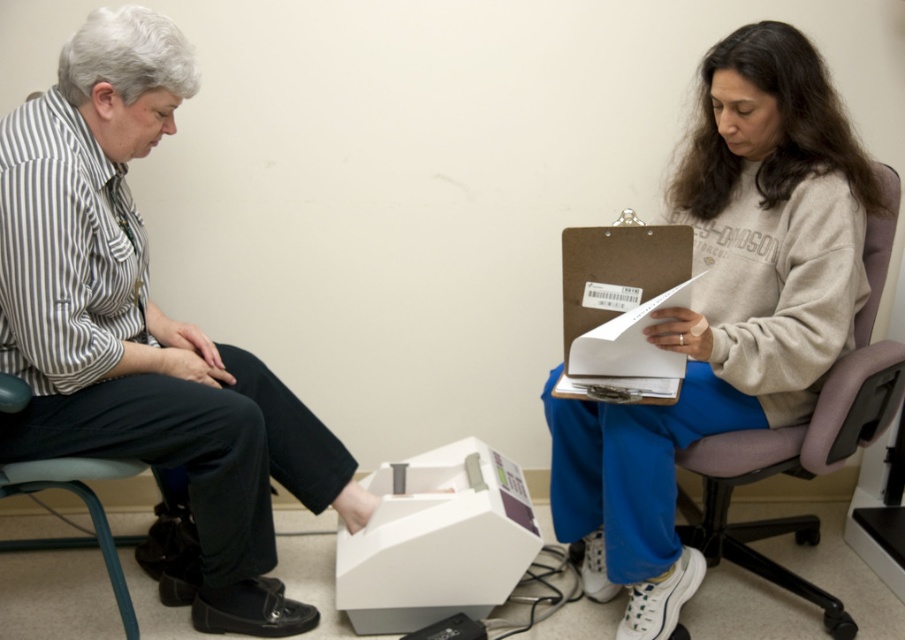
Question: Can you confirm if matte black shoe at lower left is positioned below gray fabric armchair at right?

Choices:
 (A) yes
 (B) no

Answer: (B)

Question: Which object is farther from the camera taking this photo?

Choices:
 (A) gray fabric armchair at right
 (B) matte black shoe at lower left
 (C) matte gray sweatshirt at center
 (D) white plastic machine at lower center

Answer: (D)

Question: Considering the real-world distances, which object is farthest from the matte black shoe at lower left?

Choices:
 (A) white plastic machine at lower center
 (B) matte gray sweatshirt at center

Answer: (B)

Question: Where is white plastic machine at lower center located in relation to gray fabric armchair at right in the image?

Choices:
 (A) right
 (B) left

Answer: (B)

Question: Which point is farther from the camera taking this photo?

Choices:
 (A) (437, 618)
 (B) (134, 419)

Answer: (A)

Question: Does matte gray sweatshirt at center appear under white plastic machine at lower center?

Choices:
 (A) no
 (B) yes

Answer: (A)